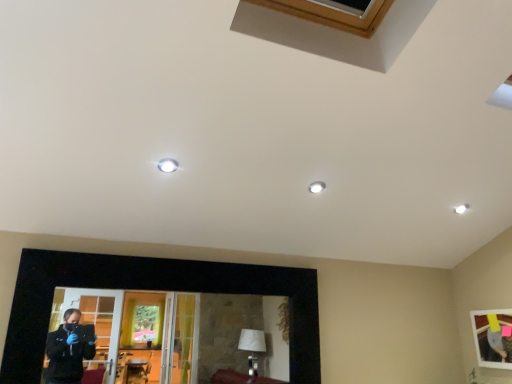
Question: Considering the positions of wooden framed picture at lower right, marked as the second picture frame in a left-to-right arrangement, and black matte picture frame at lower center, which ranks as the 1th picture frame in left-to-right order, in the image, is wooden framed picture at lower right, marked as the second picture frame in a left-to-right arrangement, bigger or smaller than black matte picture frame at lower center, which ranks as the 1th picture frame in left-to-right order,?

Choices:
 (A) big
 (B) small

Answer: (B)

Question: From their relative heights in the image, would you say wooden framed picture at lower right, the first picture frame from the right, is taller or shorter than black matte picture frame at lower center, which ranks as the second picture frame in right-to-left order?

Choices:
 (A) short
 (B) tall

Answer: (A)

Question: Based on their positions, is wooden framed picture at lower right, marked as the second picture frame in a left-to-right arrangement, located to the left or right of black matte picture frame at lower center, which ranks as the second picture frame in right-to-left order?

Choices:
 (A) left
 (B) right

Answer: (B)

Question: From a real-world perspective, is black matte picture frame at lower center, which ranks as the 1th picture frame in left-to-right order, physically located above or below wooden framed picture at lower right, marked as the second picture frame in a left-to-right arrangement?

Choices:
 (A) above
 (B) below

Answer: (A)

Question: Is point (42, 268) closer or farther from the camera than point (480, 354)?

Choices:
 (A) closer
 (B) farther

Answer: (A)

Question: Considering the positions of black matte picture frame at lower center, which ranks as the second picture frame in right-to-left order, and wooden framed picture at lower right, the first picture frame from the right, in the image, is black matte picture frame at lower center, which ranks as the second picture frame in right-to-left order, taller or shorter than wooden framed picture at lower right, the first picture frame from the right,?

Choices:
 (A) short
 (B) tall

Answer: (B)

Question: From the image's perspective, is black matte picture frame at lower center, which ranks as the 1th picture frame in left-to-right order, above or below wooden framed picture at lower right, marked as the second picture frame in a left-to-right arrangement?

Choices:
 (A) above
 (B) below

Answer: (A)